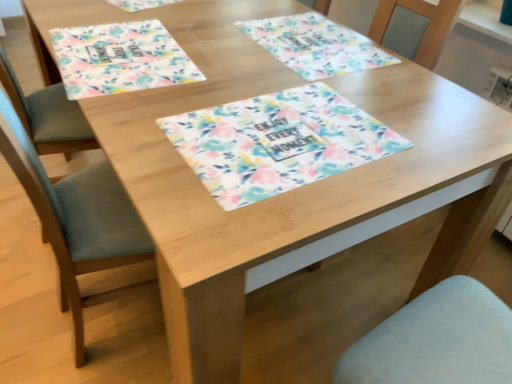
The image size is (512, 384). Describe the element at coordinates (277, 142) in the screenshot. I see `floral fabric placemat at center` at that location.

The height and width of the screenshot is (384, 512). What are the coordinates of `floral fabric placemat at center, the first place mat when ordered from right to left` in the screenshot? It's located at coord(315,45).

Is floral fabric placemat at upper left, placed as the second place mat when sorted from right to left, situated inside floral fabric placemat at center or outside?

floral fabric placemat at upper left, placed as the second place mat when sorted from right to left, is not inside floral fabric placemat at center, it's outside.

From the image's perspective, would you say floral fabric placemat at upper left, placed as the second place mat when sorted from right to left, is shown under floral fabric placemat at center?

No.

Does floral fabric placemat at upper left, placed as the second place mat when sorted from right to left, have a greater height compared to floral fabric placemat at center?

Yes.

Is floral fabric placemat at upper left, the first place mat in the left-to-right sequence, looking in the opposite direction of floral fabric placemat at center?

That's not correct — floral fabric placemat at upper left, the first place mat in the left-to-right sequence, is not looking away from floral fabric placemat at center.

Are floral fabric placemat at center and floral fabric placemat at center, the first place mat when ordered from right to left, far apart?

floral fabric placemat at center is near floral fabric placemat at center, the first place mat when ordered from right to left, not far away.

Considering the sizes of objects floral fabric placemat at center and floral fabric placemat at center, positioned as the second place mat in left-to-right order, in the image provided, who is smaller, floral fabric placemat at center or floral fabric placemat at center, positioned as the second place mat in left-to-right order,?

With smaller size is floral fabric placemat at center.

Is floral fabric placemat at center, positioned as the second place mat in left-to-right order, completely or partially inside floral fabric placemat at center?

Definitely not — floral fabric placemat at center, positioned as the second place mat in left-to-right order, is not inside floral fabric placemat at center.

Considering the points (182, 143) and (90, 47), which point is in front, point (182, 143) or point (90, 47)?

The point (182, 143) is in front.

From a real-world perspective, is floral fabric placemat at center located beneath floral fabric placemat at upper left, placed as the second place mat when sorted from right to left?

Actually, floral fabric placemat at center is physically above floral fabric placemat at upper left, placed as the second place mat when sorted from right to left, in the real world.

Is floral fabric placemat at center not inside floral fabric placemat at upper left, placed as the second place mat when sorted from right to left?

Yes, floral fabric placemat at center is outside of floral fabric placemat at upper left, placed as the second place mat when sorted from right to left.

Between floral fabric placemat at center and floral fabric placemat at upper left, the first place mat in the left-to-right sequence, which one has smaller width?

floral fabric placemat at upper left, the first place mat in the left-to-right sequence, is thinner.

Image resolution: width=512 pixels, height=384 pixels. In order to click on place mat on the right side of floral fabric placemat at center in this screenshot , I will do `click(315, 45)`.

Which point is more distant from viewer, (340, 65) or (274, 150)?

The point (340, 65) is farther from the camera.

Who is taller, floral fabric placemat at center, positioned as the second place mat in left-to-right order, or floral fabric placemat at center?

floral fabric placemat at center, positioned as the second place mat in left-to-right order.

Considering the sizes of objects floral fabric placemat at center, the first place mat when ordered from right to left, and floral fabric placemat at center in the image provided, who is wider, floral fabric placemat at center, the first place mat when ordered from right to left, or floral fabric placemat at center?

With larger width is floral fabric placemat at center.

Is floral fabric placemat at upper left, placed as the second place mat when sorted from right to left, to the left or to the right of floral fabric placemat at center, the first place mat when ordered from right to left, in the image?

Based on their positions, floral fabric placemat at upper left, placed as the second place mat when sorted from right to left, is located to the left of floral fabric placemat at center, the first place mat when ordered from right to left.

Based on the photo, between floral fabric placemat at upper left, placed as the second place mat when sorted from right to left, and floral fabric placemat at center, positioned as the second place mat in left-to-right order, which one has larger size?

floral fabric placemat at upper left, placed as the second place mat when sorted from right to left.

Does floral fabric placemat at upper left, placed as the second place mat when sorted from right to left, come in front of floral fabric placemat at center, positioned as the second place mat in left-to-right order?

Yes, it is in front of floral fabric placemat at center, positioned as the second place mat in left-to-right order.

Is floral fabric placemat at upper left, placed as the second place mat when sorted from right to left, spatially inside floral fabric placemat at center, positioned as the second place mat in left-to-right order, or outside of it?

floral fabric placemat at upper left, placed as the second place mat when sorted from right to left, is spatially situated outside floral fabric placemat at center, positioned as the second place mat in left-to-right order.

From a real-world perspective, which object rests below the other?

In real-world perspective, floral fabric placemat at upper left, placed as the second place mat when sorted from right to left, is lower.

You are a GUI agent. You are given a task and a screenshot of the screen. Output one action in this format:
    pyautogui.click(x=<x>, y=<y>)
    Task: Click on the place mat located above the floral fabric placemat at upper left, placed as the second place mat when sorted from right to left (from the image's perspective)
    
    Given the screenshot: What is the action you would take?
    pyautogui.click(x=315, y=45)

How distant is floral fabric placemat at center, positioned as the second place mat in left-to-right order, from floral fabric placemat at upper left, placed as the second place mat when sorted from right to left?

floral fabric placemat at center, positioned as the second place mat in left-to-right order, and floral fabric placemat at upper left, placed as the second place mat when sorted from right to left, are 15.56 inches apart from each other.

Does floral fabric placemat at center, positioned as the second place mat in left-to-right order, come behind floral fabric placemat at upper left, the first place mat in the left-to-right sequence?

Yes, floral fabric placemat at center, positioned as the second place mat in left-to-right order, is behind floral fabric placemat at upper left, the first place mat in the left-to-right sequence.

Locate an element on the screen. place mat that is the 1st object located above the floral fabric placemat at center (from the image's perspective) is located at coordinates (120, 59).

Where is `the 2nd place mat behind the floral fabric placemat at center, starting your count from the anchor`? the 2nd place mat behind the floral fabric placemat at center, starting your count from the anchor is located at coordinates (315, 45).

Looking at this image, when comparing their distances from floral fabric placemat at center, does floral fabric placemat at upper left, placed as the second place mat when sorted from right to left, or floral fabric placemat at center, the first place mat when ordered from right to left, seem closer?

floral fabric placemat at upper left, placed as the second place mat when sorted from right to left, is positioned closer to the anchor floral fabric placemat at center.

Which object lies further to the anchor point floral fabric placemat at center, floral fabric placemat at center, the first place mat when ordered from right to left, or floral fabric placemat at upper left, placed as the second place mat when sorted from right to left?

floral fabric placemat at center, the first place mat when ordered from right to left, is positioned further to the anchor floral fabric placemat at center.

Based on their spatial positions, is floral fabric placemat at center or floral fabric placemat at upper left, the first place mat in the left-to-right sequence, further from floral fabric placemat at center, positioned as the second place mat in left-to-right order?

Among the two, floral fabric placemat at upper left, the first place mat in the left-to-right sequence, is located further to floral fabric placemat at center, positioned as the second place mat in left-to-right order.

Considering their positions, is floral fabric placemat at upper left, the first place mat in the left-to-right sequence, positioned closer to floral fabric placemat at center, the first place mat when ordered from right to left, than floral fabric placemat at center?

Among the two, floral fabric placemat at center is located nearer to floral fabric placemat at center, the first place mat when ordered from right to left.

Which object lies further to the anchor point floral fabric placemat at upper left, placed as the second place mat when sorted from right to left, floral fabric placemat at center, the first place mat when ordered from right to left, or floral fabric placemat at center?

floral fabric placemat at center, the first place mat when ordered from right to left, is positioned further to the anchor floral fabric placemat at upper left, placed as the second place mat when sorted from right to left.

Estimate the real-world distances between objects in this image. Which object is closer to floral fabric placemat at upper left, the first place mat in the left-to-right sequence, floral fabric placemat at center or floral fabric placemat at center, positioned as the second place mat in left-to-right order?

Based on the image, floral fabric placemat at center appears to be nearer to floral fabric placemat at upper left, the first place mat in the left-to-right sequence.

Identify the location of tablecloth situated between floral fabric placemat at upper left, the first place mat in the left-to-right sequence, and floral fabric placemat at center, the first place mat when ordered from right to left, from left to right. (277, 142).